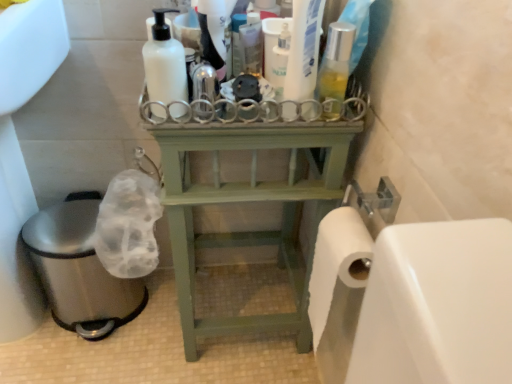
Question: Does translucent plastic spray bottle at center, which appears as the second cleaning product when viewed from the left, have a larger size compared to white matte bottle at upper center, the first cleaning product when ordered from left to right?

Choices:
 (A) no
 (B) yes

Answer: (A)

Question: Considering the relative sizes of translucent plastic spray bottle at center, which appears as the second cleaning product when viewed from the left, and white matte bottle at upper center, the first cleaning product when ordered from left to right, in the image provided, is translucent plastic spray bottle at center, which appears as the second cleaning product when viewed from the left, wider than white matte bottle at upper center, the first cleaning product when ordered from left to right,?

Choices:
 (A) no
 (B) yes

Answer: (A)

Question: Can you confirm if translucent plastic spray bottle at center, which is the 3th cleaning product from right to left, is taller than white matte bottle at upper center, the first cleaning product when ordered from left to right?

Choices:
 (A) yes
 (B) no

Answer: (B)

Question: Is translucent plastic spray bottle at center, which is the 3th cleaning product from right to left, with white matte bottle at upper center, which appears as the fourth cleaning product when viewed from the right?

Choices:
 (A) no
 (B) yes

Answer: (B)

Question: Is translucent plastic spray bottle at center, which appears as the second cleaning product when viewed from the left, positioned far away from white matte bottle at upper center, which appears as the fourth cleaning product when viewed from the right?

Choices:
 (A) yes
 (B) no

Answer: (B)

Question: Is white matte bottle at upper center, which appears as the fourth cleaning product when viewed from the right, situated inside green wood shelf at center or outside?

Choices:
 (A) outside
 (B) inside

Answer: (A)

Question: From a real-world perspective, is white matte bottle at upper center, which appears as the fourth cleaning product when viewed from the right, positioned above or below green wood shelf at center?

Choices:
 (A) above
 (B) below

Answer: (A)

Question: Is point coord(167,9) closer or farther from the camera than point coord(305,269)?

Choices:
 (A) closer
 (B) farther

Answer: (A)

Question: In terms of width, does white matte bottle at upper center, which appears as the fourth cleaning product when viewed from the right, look wider or thinner when compared to green wood shelf at center?

Choices:
 (A) wide
 (B) thin

Answer: (B)

Question: Relative to translucent plastic spray bottle at center, which appears as the second cleaning product when viewed from the left, is white matte bottle at upper center, which appears as the fourth cleaning product when viewed from the right, in front or behind?

Choices:
 (A) front
 (B) behind

Answer: (A)

Question: Is white matte bottle at upper center, the first cleaning product when ordered from left to right, wider or thinner than translucent plastic spray bottle at center, which appears as the second cleaning product when viewed from the left?

Choices:
 (A) wide
 (B) thin

Answer: (A)

Question: From the image's perspective, is white matte bottle at upper center, which appears as the fourth cleaning product when viewed from the right, located above or below translucent plastic spray bottle at center, which appears as the second cleaning product when viewed from the left?

Choices:
 (A) below
 (B) above

Answer: (A)

Question: Is point (159, 51) positioned closer to the camera than point (221, 49)?

Choices:
 (A) closer
 (B) farther

Answer: (A)

Question: Is green wood shelf at center spatially inside translucent plastic bottle at center, the first cleaning product from the right, or outside of it?

Choices:
 (A) outside
 (B) inside

Answer: (A)

Question: From a real-world perspective, relative to translucent plastic bottle at center, placed as the 4th cleaning product when sorted from left to right, is green wood shelf at center vertically above or below?

Choices:
 (A) above
 (B) below

Answer: (B)